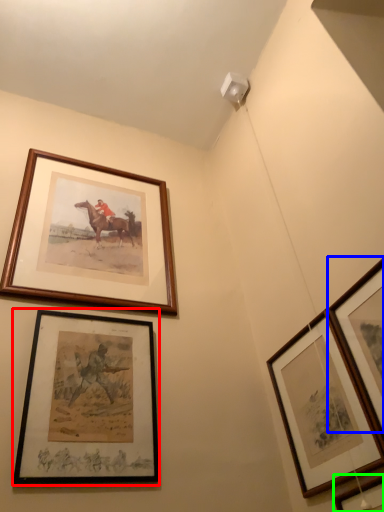
Question: Which is farther away from picture frame (highlighted by a red box)? picture frame (highlighted by a blue box) or picture frame (highlighted by a green box)?

Choices:
 (A) picture frame
 (B) picture frame

Answer: (A)